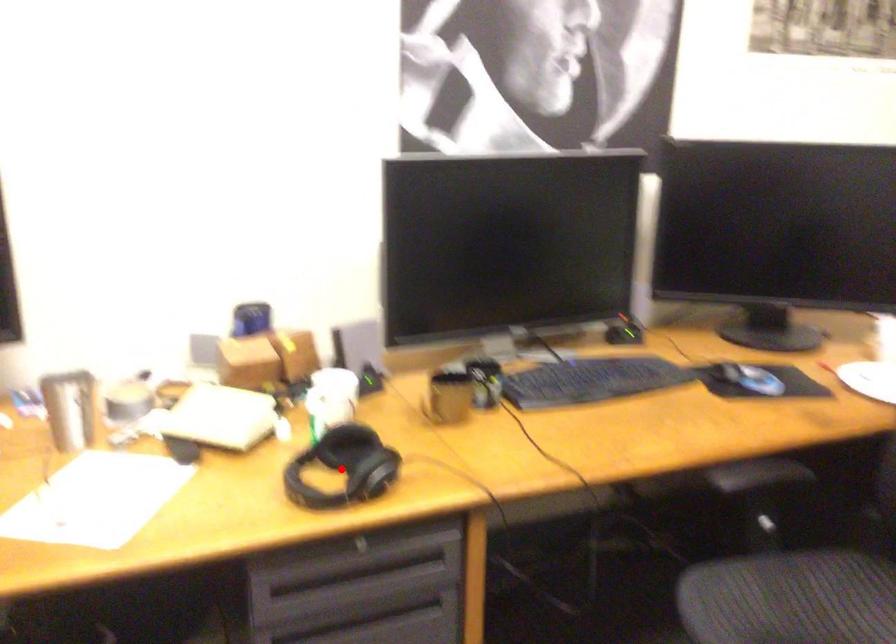
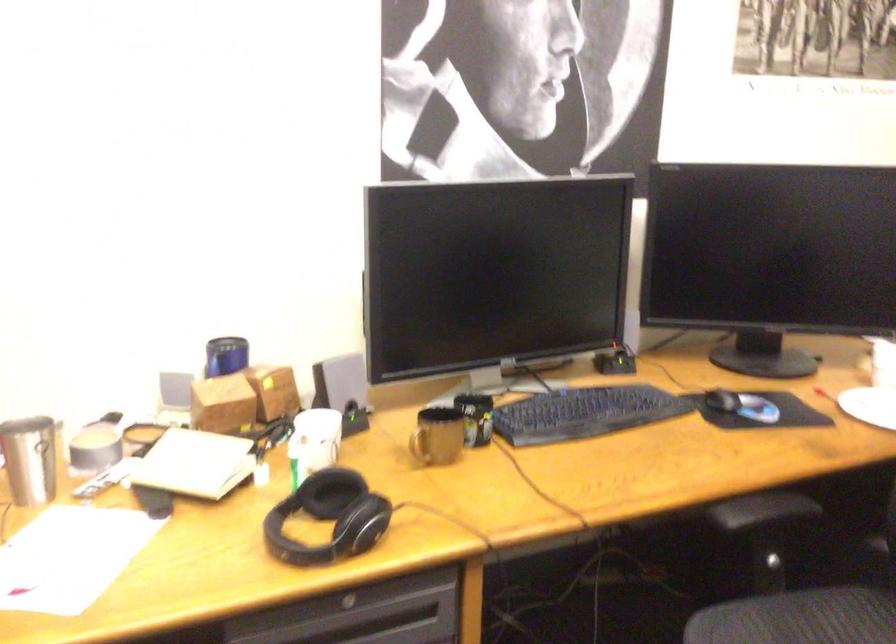
Find the pixel in the second image that matches the highlighted location in the first image.

(329, 518)